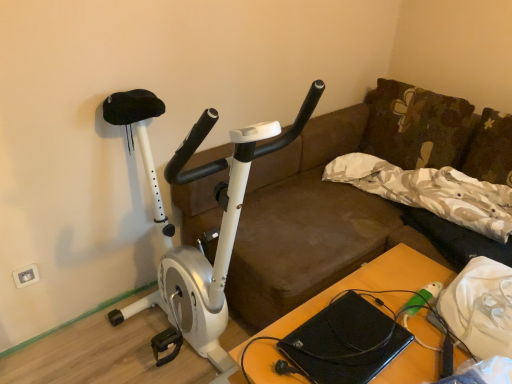
Question: From a real-world perspective, is wooden table at center positioned over beige floral fabric pillow at upper right, the first pillow positioned from the bottom, based on gravity?

Choices:
 (A) yes
 (B) no

Answer: (B)

Question: Is wooden table at center shorter than beige floral fabric pillow at upper right, placed as the 2th pillow when sorted from top to bottom?

Choices:
 (A) yes
 (B) no

Answer: (B)

Question: Is wooden table at center to the left of beige floral fabric pillow at upper right, placed as the 2th pillow when sorted from top to bottom, from the viewer's perspective?

Choices:
 (A) no
 (B) yes

Answer: (B)

Question: Is there a large distance between wooden table at center and beige floral fabric pillow at upper right, the first pillow positioned from the bottom?

Choices:
 (A) no
 (B) yes

Answer: (A)

Question: Would you say beige floral fabric pillow at upper right, placed as the 2th pillow when sorted from top to bottom, is part of wooden table at center's contents?

Choices:
 (A) no
 (B) yes

Answer: (A)

Question: Is wooden table at center taller than beige floral fabric pillow at upper right, the first pillow positioned from the bottom?

Choices:
 (A) no
 (B) yes

Answer: (B)

Question: Considering the relative sizes of black matte laptop at lower center and white matte stationary bicycle at left in the image provided, is black matte laptop at lower center bigger than white matte stationary bicycle at left?

Choices:
 (A) yes
 (B) no

Answer: (B)

Question: From the image's perspective, is black matte laptop at lower center over white matte stationary bicycle at left?

Choices:
 (A) no
 (B) yes

Answer: (A)

Question: Does black matte laptop at lower center touch white matte stationary bicycle at left?

Choices:
 (A) yes
 (B) no

Answer: (B)

Question: Does black matte laptop at lower center come behind white matte stationary bicycle at left?

Choices:
 (A) yes
 (B) no

Answer: (A)

Question: From a real-world perspective, is black matte laptop at lower center located higher than white matte stationary bicycle at left?

Choices:
 (A) yes
 (B) no

Answer: (B)

Question: Does black matte laptop at lower center have a smaller size compared to white matte stationary bicycle at left?

Choices:
 (A) no
 (B) yes

Answer: (B)

Question: Can you confirm if white plastic electric outlet at lower left is shorter than beige floral fabric pillow at upper right, the first pillow positioned from the bottom?

Choices:
 (A) no
 (B) yes

Answer: (B)